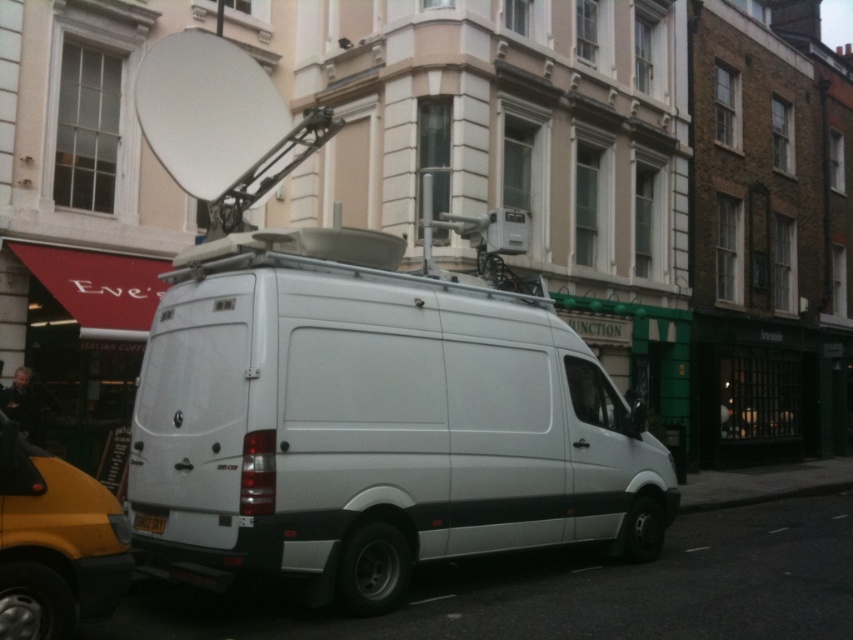
Does white matte van at center appear over black plastic license plate at rear?

Correct, white matte van at center is located above black plastic license plate at rear.

Consider the image. Who is positioned more to the right, white matte van at center or black plastic license plate at rear?

Positioned to the right is white matte van at center.

Describe the element at coordinates (372, 422) in the screenshot. I see `white matte van at center` at that location.

Find the location of `white matte van at center`. white matte van at center is located at coordinates (372, 422).